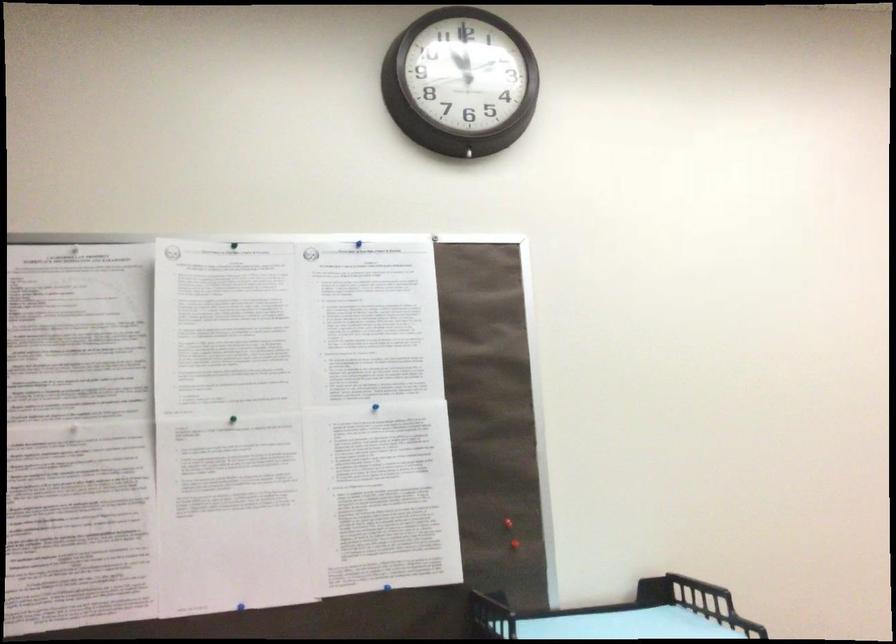
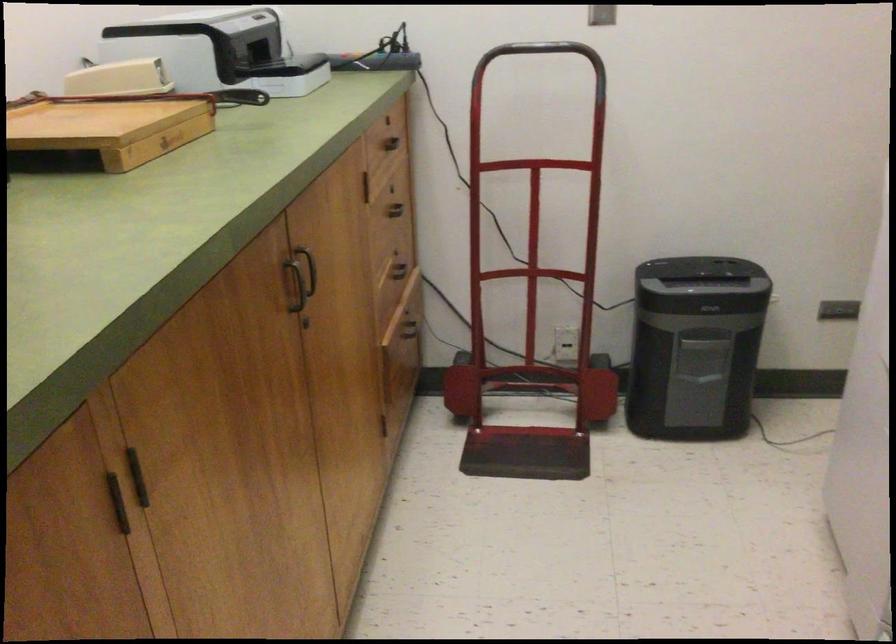
Based on the continuous images, in which direction is the camera rotating?

The rotation direction of the camera is right-down.